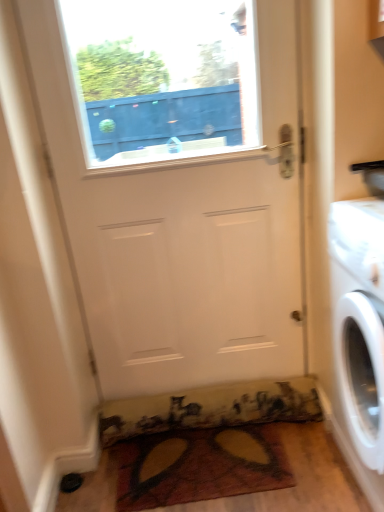
Question: Is white glossy washing machine at right taller or shorter than multicolored fabric doormat at lower center, which appears as the first doormat when ordered from the bottom?

Choices:
 (A) short
 (B) tall

Answer: (B)

Question: Considering the positions of white glossy washing machine at right and multicolored fabric doormat at lower center, which is the second doormat from top to bottom, in the image, is white glossy washing machine at right bigger or smaller than multicolored fabric doormat at lower center, which is the second doormat from top to bottom,?

Choices:
 (A) big
 (B) small

Answer: (A)

Question: Estimate the real-world distances between objects in this image. Which object is closer to the white matte door at center?

Choices:
 (A) white glossy washing machine at right
 (B) multicolored fabric doormat at lower center, the second doormat in the bottom-to-top sequence
 (C) multicolored fabric doormat at lower center, which is the second doormat from top to bottom

Answer: (B)

Question: Which object is the farthest from the multicolored fabric doormat at lower center, which is the second doormat from top to bottom?

Choices:
 (A) white glossy washing machine at right
 (B) white matte door at center
 (C) multicolored fabric doormat at lower center, the second doormat in the bottom-to-top sequence

Answer: (B)